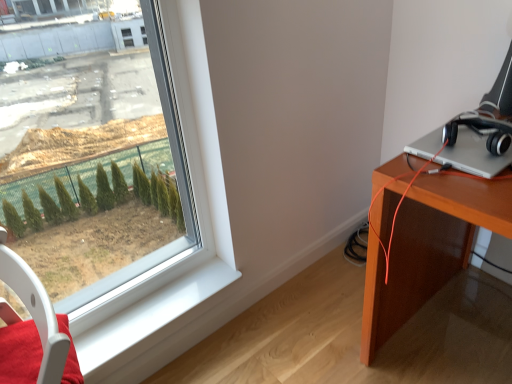
Locate an element on the screen. The height and width of the screenshot is (384, 512). free region under black matte headphones at right (from a real-world perspective) is located at coordinates (480, 141).